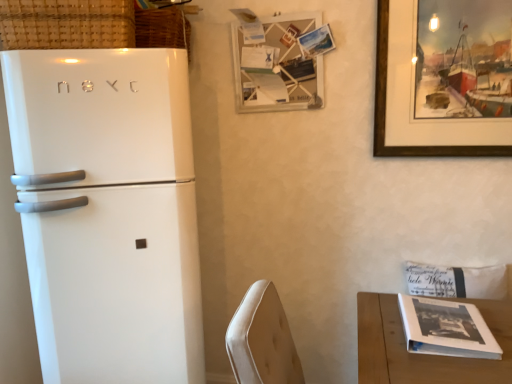
Identify the location of white wood table at lower right. (422, 354).

What do you see at coordinates (422, 354) in the screenshot? The image size is (512, 384). I see `white wood table at lower right` at bounding box center [422, 354].

What do you see at coordinates (278, 67) in the screenshot? The width and height of the screenshot is (512, 384). I see `wooden picture frame at upper center, the 1th picture frame from the left` at bounding box center [278, 67].

What do you see at coordinates (108, 212) in the screenshot? I see `white glossy refrigerator at left` at bounding box center [108, 212].

Identify the location of white glossy refrigerator at left. (108, 212).

This screenshot has width=512, height=384. What are the coordinates of `woven wicker basket at upper left, the 1th basket in the front-to-back sequence` in the screenshot? It's located at (67, 24).

What is the approximate width of wooden framed painting at upper right, acting as the second picture frame starting from the left?

wooden framed painting at upper right, acting as the second picture frame starting from the left, is 1.74 inches wide.

Where is `white wood table at lower right`? white wood table at lower right is located at coordinates (422, 354).

Is white wood table at lower right to the left of white glossy refrigerator at left from the viewer's perspective?

In fact, white wood table at lower right is to the right of white glossy refrigerator at left.

Between point (435, 357) and point (133, 54), which one is positioned behind?

Point (133, 54)

From a real-world perspective, is white wood table at lower right positioned above or below white glossy refrigerator at left?

Clearly, from a real-world perspective, white wood table at lower right is below white glossy refrigerator at left.

Image resolution: width=512 pixels, height=384 pixels. Find the location of `table to the right of white glossy refrigerator at left`. table to the right of white glossy refrigerator at left is located at coordinates (422, 354).

Which is closer to the camera, (110, 295) or (74, 19)?

The point (74, 19) is closer to the camera.

Is white glossy refrigerator at left spatially inside woven wicker basket at upper left, the second basket from the back, or outside of it?

white glossy refrigerator at left is not enclosed by woven wicker basket at upper left, the second basket from the back.

From a real-world perspective, is white glossy refrigerator at left over woven wicker basket at upper left, the 1th basket in the front-to-back sequence?

Incorrect, from a real-world perspective, white glossy refrigerator at left is lower than woven wicker basket at upper left, the 1th basket in the front-to-back sequence.

Is white glossy refrigerator at left oriented away from woven wicker basket at upper left, the 1th basket in the front-to-back sequence?

white glossy refrigerator at left is not turned away from woven wicker basket at upper left, the 1th basket in the front-to-back sequence.

Which is more to the right, white glossy refrigerator at left or wooden picture frame at upper center, which is the second picture frame from right to left?

wooden picture frame at upper center, which is the second picture frame from right to left, is more to the right.

From a real-world perspective, which is physically above, white glossy refrigerator at left or wooden picture frame at upper center, the 1th picture frame from the left?

In real-world perspective, wooden picture frame at upper center, the 1th picture frame from the left, is above.

Can you confirm if white glossy refrigerator at left is thinner than wooden picture frame at upper center, which is the second picture frame from right to left?

In fact, white glossy refrigerator at left might be wider than wooden picture frame at upper center, which is the second picture frame from right to left.

From the image's perspective, which object appears higher, white glossy refrigerator at left or wooden picture frame at upper center, the 1th picture frame from the left?

wooden picture frame at upper center, the 1th picture frame from the left, from the image's perspective.

Considering the sizes of objects woven straw basket at upper left, marked as the 2th basket in a front-to-back arrangement, and wooden picture frame at upper center, the 1th picture frame from the left, in the image provided, who is bigger, woven straw basket at upper left, marked as the 2th basket in a front-to-back arrangement, or wooden picture frame at upper center, the 1th picture frame from the left,?

wooden picture frame at upper center, the 1th picture frame from the left.

Is woven straw basket at upper left, the first basket viewed from the back, oriented towards wooden picture frame at upper center, which is the second picture frame from right to left?

No, woven straw basket at upper left, the first basket viewed from the back, is not oriented towards wooden picture frame at upper center, which is the second picture frame from right to left.

Which object is positioned more to the left, woven straw basket at upper left, the first basket viewed from the back, or wooden picture frame at upper center, the 1th picture frame from the left?

From the viewer's perspective, woven straw basket at upper left, the first basket viewed from the back, appears more on the left side.

Which is less distant, (146, 33) or (273, 107)?

Positioned in front is point (146, 33).

Based on their positions, is woven straw basket at upper left, marked as the 2th basket in a front-to-back arrangement, located to the left or right of white wood table at lower right?

Based on their positions, woven straw basket at upper left, marked as the 2th basket in a front-to-back arrangement, is located to the left of white wood table at lower right.

Between woven straw basket at upper left, the first basket viewed from the back, and white wood table at lower right, which one has more height?

Standing taller between the two is white wood table at lower right.

Is woven straw basket at upper left, the first basket viewed from the back, not close to white wood table at lower right?

Yes, woven straw basket at upper left, the first basket viewed from the back, is far from white wood table at lower right.

Is wooden framed painting at upper right, the first picture frame viewed from the right, thinner than white glossy refrigerator at left?

Indeed, wooden framed painting at upper right, the first picture frame viewed from the right, has a lesser width compared to white glossy refrigerator at left.

Considering the relative sizes of wooden framed painting at upper right, the first picture frame viewed from the right, and white glossy refrigerator at left in the image provided, is wooden framed painting at upper right, the first picture frame viewed from the right, bigger than white glossy refrigerator at left?

No.

Is wooden framed painting at upper right, acting as the second picture frame starting from the left, located outside white glossy refrigerator at left?

Yes, wooden framed painting at upper right, acting as the second picture frame starting from the left, is not within white glossy refrigerator at left.

Is white glossy refrigerator at left surrounded by woven straw basket at upper left, marked as the 2th basket in a front-to-back arrangement?

No, white glossy refrigerator at left is not a part of woven straw basket at upper left, marked as the 2th basket in a front-to-back arrangement.

Who is smaller, woven straw basket at upper left, the first basket viewed from the back, or white glossy refrigerator at left?

woven straw basket at upper left, the first basket viewed from the back, is smaller.

From a real-world perspective, which object rests below the other?

In real-world perspective, white glossy refrigerator at left is lower.

Considering the positions of objects woven straw basket at upper left, marked as the 2th basket in a front-to-back arrangement, and white glossy refrigerator at left in the image provided, who is more to the left, woven straw basket at upper left, marked as the 2th basket in a front-to-back arrangement, or white glossy refrigerator at left?

white glossy refrigerator at left.

Image resolution: width=512 pixels, height=384 pixels. Identify the location of table below the white glossy refrigerator at left (from a real-world perspective). (422, 354).

Locate an element on the screen. The image size is (512, 384). refrigerator to the right of woven wicker basket at upper left, the 1th basket in the front-to-back sequence is located at coordinates (108, 212).

From the image, which object appears to be nearer to woven wicker basket at upper left, the second basket from the back, wooden picture frame at upper center, which is the second picture frame from right to left, or woven straw basket at upper left, marked as the 2th basket in a front-to-back arrangement?

woven straw basket at upper left, marked as the 2th basket in a front-to-back arrangement, is positioned closer to the anchor woven wicker basket at upper left, the second basket from the back.

From the picture: When comparing their distances from white glossy refrigerator at left, does woven straw basket at upper left, the first basket viewed from the back, or woven wicker basket at upper left, the 1th basket in the front-to-back sequence, seem closer?

The object closer to white glossy refrigerator at left is woven wicker basket at upper left, the 1th basket in the front-to-back sequence.

When comparing their distances from woven straw basket at upper left, marked as the 2th basket in a front-to-back arrangement, does wooden picture frame at upper center, which is the second picture frame from right to left, or woven wicker basket at upper left, the second basket from the back, seem further?

The object further to woven straw basket at upper left, marked as the 2th basket in a front-to-back arrangement, is wooden picture frame at upper center, which is the second picture frame from right to left.

Considering their positions, is white wood table at lower right positioned further to wooden picture frame at upper center, which is the second picture frame from right to left, than white glossy refrigerator at left?

Based on the image, white wood table at lower right appears to be further to wooden picture frame at upper center, which is the second picture frame from right to left.

Looking at this image, considering their positions, is white wood table at lower right positioned further to woven straw basket at upper left, the first basket viewed from the back, than wooden picture frame at upper center, which is the second picture frame from right to left?

white wood table at lower right.

Based on their spatial positions, is wooden framed painting at upper right, the first picture frame viewed from the right, or white glossy refrigerator at left further from white wood table at lower right?

white glossy refrigerator at left.

Based on their spatial positions, is woven wicker basket at upper left, the 1th basket in the front-to-back sequence, or white glossy refrigerator at left closer to woven straw basket at upper left, the first basket viewed from the back?

woven wicker basket at upper left, the 1th basket in the front-to-back sequence, is closer to woven straw basket at upper left, the first basket viewed from the back.

From the image, which object appears to be farther from white wood table at lower right, wooden framed painting at upper right, acting as the second picture frame starting from the left, or wooden picture frame at upper center, which is the second picture frame from right to left?

Based on the image, wooden picture frame at upper center, which is the second picture frame from right to left, appears to be further to white wood table at lower right.

Locate an element on the screen. This screenshot has width=512, height=384. basket between white glossy refrigerator at left and white wood table at lower right in the horizontal direction is located at coordinates [162, 29].

I want to click on picture frame between wooden picture frame at upper center, the 1th picture frame from the left, and white wood table at lower right in the up-down direction, so (410, 112).

Identify the location of basket located between woven wicker basket at upper left, the second basket from the back, and wooden framed painting at upper right, acting as the second picture frame starting from the left, in the left-right direction. The height and width of the screenshot is (384, 512). (162, 29).

Find the location of `basket between woven wicker basket at upper left, the second basket from the back, and wooden picture frame at upper center, the 1th picture frame from the left`. basket between woven wicker basket at upper left, the second basket from the back, and wooden picture frame at upper center, the 1th picture frame from the left is located at coordinates (162, 29).